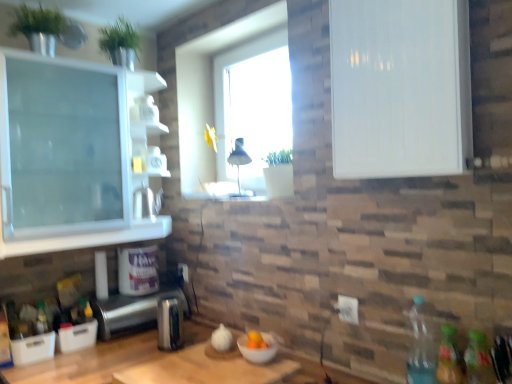
Question: Does translucent plastic bottle at lower right, which is the 1th bottle in right-to-left order, appear on the right side of clear plastic bottle at lower right, the 2th bottle when ordered from left to right?

Choices:
 (A) no
 (B) yes

Answer: (B)

Question: Could clear plastic bottle at lower right, the 2th bottle when ordered from left to right, be considered to be inside translucent plastic bottle at lower right, the 1th bottle from the front?

Choices:
 (A) yes
 (B) no

Answer: (B)

Question: From a real-world perspective, is translucent plastic bottle at lower right, which is the 1th bottle in right-to-left order, on clear plastic bottle at lower right, which ranks as the third bottle in front-to-back order?

Choices:
 (A) no
 (B) yes

Answer: (A)

Question: Are translucent plastic bottle at lower right, which is the 1th bottle in right-to-left order, and clear plastic bottle at lower right, which ranks as the third bottle in front-to-back order, far apart?

Choices:
 (A) no
 (B) yes

Answer: (A)

Question: From the image's perspective, is translucent plastic bottle at lower right, which is the 4th bottle from back to front, located beneath clear plastic bottle at lower right, which ranks as the third bottle in front-to-back order?

Choices:
 (A) yes
 (B) no

Answer: (A)

Question: Is translucent plastic bottle at lower right, acting as the fourth bottle starting from the left, outside of clear plastic bottle at lower right, the 2th bottle from the back?

Choices:
 (A) no
 (B) yes

Answer: (B)

Question: Does white glossy cabinet at upper right have a greater width compared to satin silver toaster at lower center, which is the 3th appliance in back-to-front order?

Choices:
 (A) no
 (B) yes

Answer: (B)

Question: Does white glossy cabinet at upper right contain satin silver toaster at lower center, which is the 3th appliance in back-to-front order?

Choices:
 (A) yes
 (B) no

Answer: (B)

Question: Can you confirm if white glossy cabinet at upper right is positioned to the left of satin silver toaster at lower center, which is the 1th appliance in front-to-back order?

Choices:
 (A) yes
 (B) no

Answer: (B)

Question: Does white glossy cabinet at upper right have a greater height compared to satin silver toaster at lower center, which is the 1th appliance in front-to-back order?

Choices:
 (A) no
 (B) yes

Answer: (B)

Question: Is white glossy cabinet at upper right positioned with its back to satin silver toaster at lower center, which is the 1th appliance in front-to-back order?

Choices:
 (A) yes
 (B) no

Answer: (B)

Question: Is white glossy cabinet at upper right not within satin silver toaster at lower center, which is the 3th appliance in back-to-front order?

Choices:
 (A) no
 (B) yes

Answer: (B)

Question: Is translucent glass jar at upper center closer to the viewer compared to clear plastic bottle at lower right, which appears as the third bottle when viewed from the right?

Choices:
 (A) no
 (B) yes

Answer: (A)